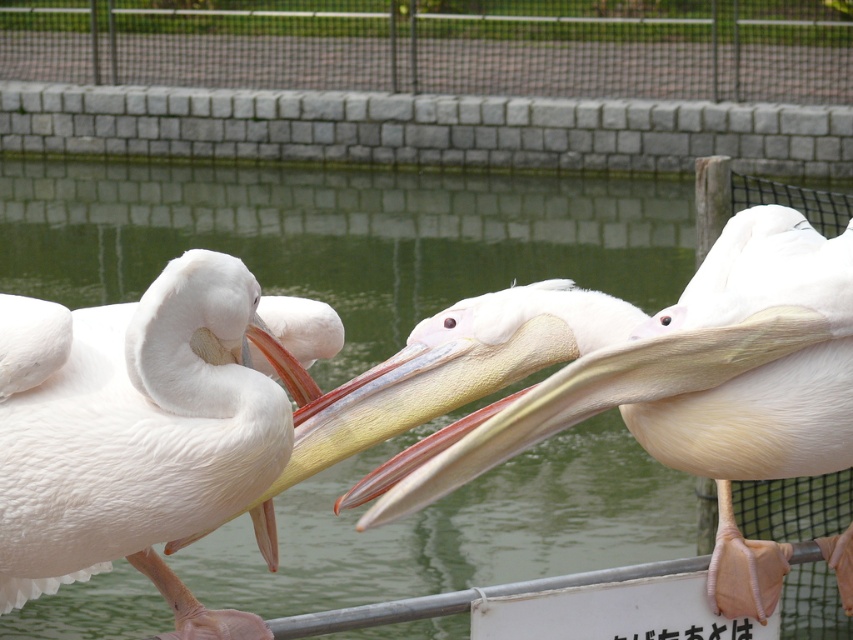
You are a visitor at the zoo and want to take a photo of the white feathered pelican at center without the metal mesh fence at upper center appearing in the shot. How can you adjust your position to achieve this?

Move closer to the white feathered pelican at center so that it fills the frame, as it is closer to the viewer than the metal mesh fence at upper center. This adjustment will help exclude the fence from the photo.

You are a zookeeper observing the pelicans. You notice the white smooth pelican at center and the metal mesh fence at upper center. Which object is shorter in height?

The white smooth pelican at center is shorter in height than the metal mesh fence at upper center.

You are observing the pelicans at the zoo and need to locate the white feathered pelican at center. According to the coordinates provided, where exactly is it positioned?

The white feathered pelican at center is located at point coordinates of 0.673 on the x axis and 0.162 on the y axis.